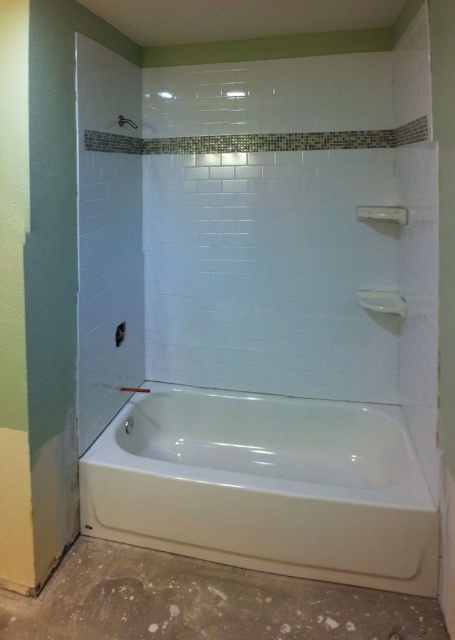
Is point (431, 522) positioned after point (126, 120)?

No, it is in front of (126, 120).

Does white glossy bathtub at center have a lesser width compared to white glossy shower at upper center?

Incorrect, white glossy bathtub at center's width is not less than white glossy shower at upper center's.

This screenshot has width=455, height=640. What are the coordinates of `white glossy bathtub at center` in the screenshot? It's located at (266, 486).